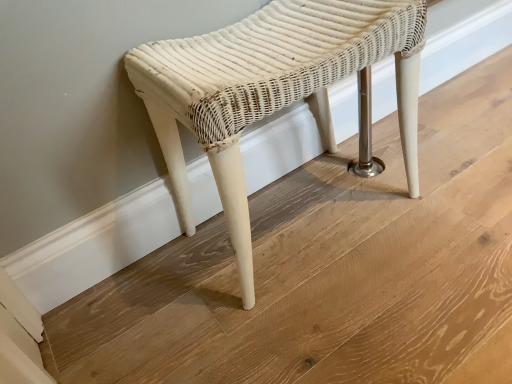
Locate an element on the screen. unoccupied region to the right of white wicker stool at center is located at coordinates (451, 212).